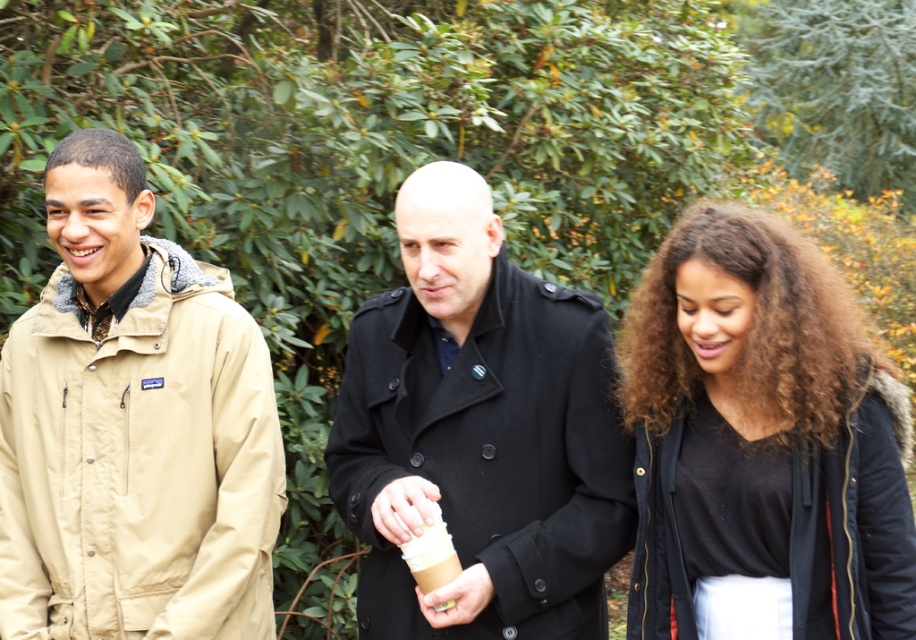
Question: Does black matte coat at center have a smaller size compared to brown paper cup at center?

Choices:
 (A) no
 (B) yes

Answer: (A)

Question: Which object is the farthest from the brown paper cup at center?

Choices:
 (A) black matte coat at center
 (B) black matte jacket at right
 (C) tan fabric jacket at left

Answer: (C)

Question: Which object is the closest to the black matte jacket at right?

Choices:
 (A) brown paper cup at center
 (B) tan fabric jacket at left
 (C) black matte coat at center

Answer: (C)

Question: Which object is the closest to the brown paper cup at center?

Choices:
 (A) black matte jacket at right
 (B) tan fabric jacket at left
 (C) black matte coat at center

Answer: (C)

Question: Is black matte jacket at right bigger than brown paper cup at center?

Choices:
 (A) no
 (B) yes

Answer: (B)

Question: In this image, where is tan fabric jacket at left located relative to brown paper cup at center?

Choices:
 (A) below
 (B) above

Answer: (B)